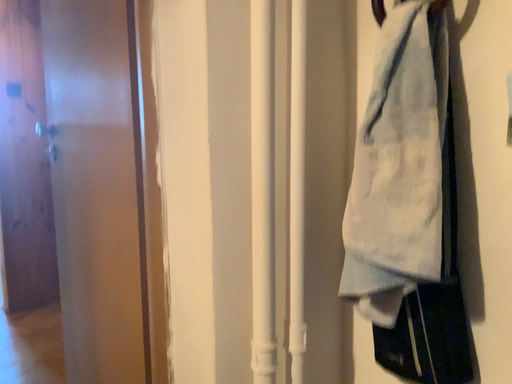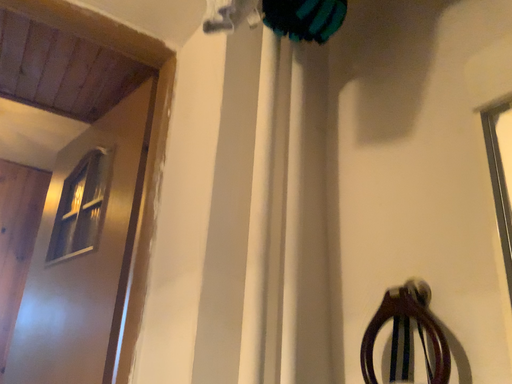
Question: Which way did the camera rotate in the video?

Choices:
 (A) rotated downward
 (B) rotated upward

Answer: (B)